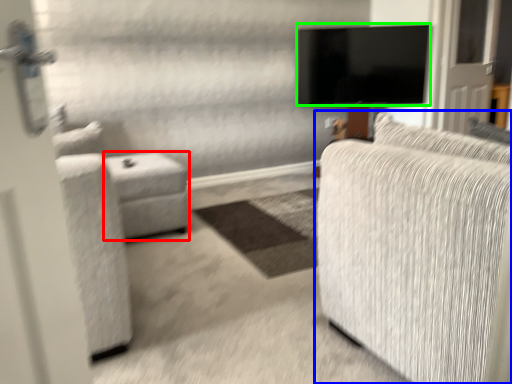
Question: Which is farther away from table (highlighted by a red box)? studio couch (highlighted by a blue box) or television (highlighted by a green box)?

Choices:
 (A) studio couch
 (B) television

Answer: (B)